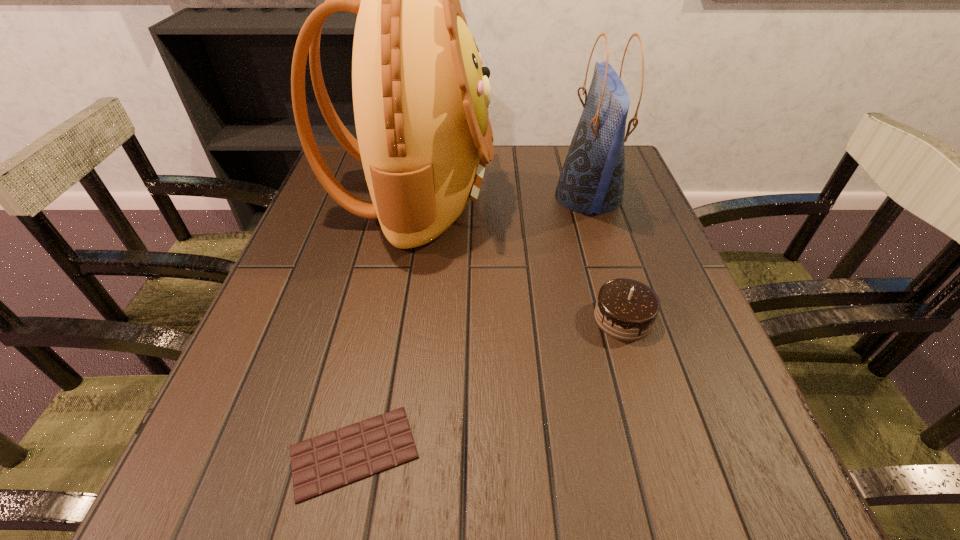
At what (x,y) coordinates should I click in order to perform the action: click on backpack. Please return your answer as a coordinate pair (x, y). This screenshot has height=540, width=960. Looking at the image, I should click on (420, 94).

Where is `shopping bag`? This screenshot has height=540, width=960. shopping bag is located at coordinates (592, 179).

Locate an element on the screen. the third farthest object is located at coordinates (626, 309).

Identify the location of chocolate cake. (626, 309).

This screenshot has width=960, height=540. Find the location of `the shortest object`. the shortest object is located at coordinates (332, 460).

You are a GUI agent. You are given a task and a screenshot of the screen. Output one action in this format:
    pyautogui.click(x=<x>, y=<y>)
    Task: Click on the chocolate bar
    This screenshot has width=960, height=540.
    Given the screenshot: What is the action you would take?
    pyautogui.click(x=332, y=460)

Identify the location of blank area located 0.170m on the front-facing side of the backpack. The height and width of the screenshot is (540, 960). (563, 197).

I want to click on vacant position located 0.370m on the left of the third shortest object, so pyautogui.click(x=403, y=197).

Locate an element on the screen. The width and height of the screenshot is (960, 540). vacant space located 0.080m on the left of the third tallest object is located at coordinates (550, 318).

Where is `vacant point located on the back of the chocolate bar`? The image size is (960, 540). vacant point located on the back of the chocolate bar is located at coordinates (396, 255).